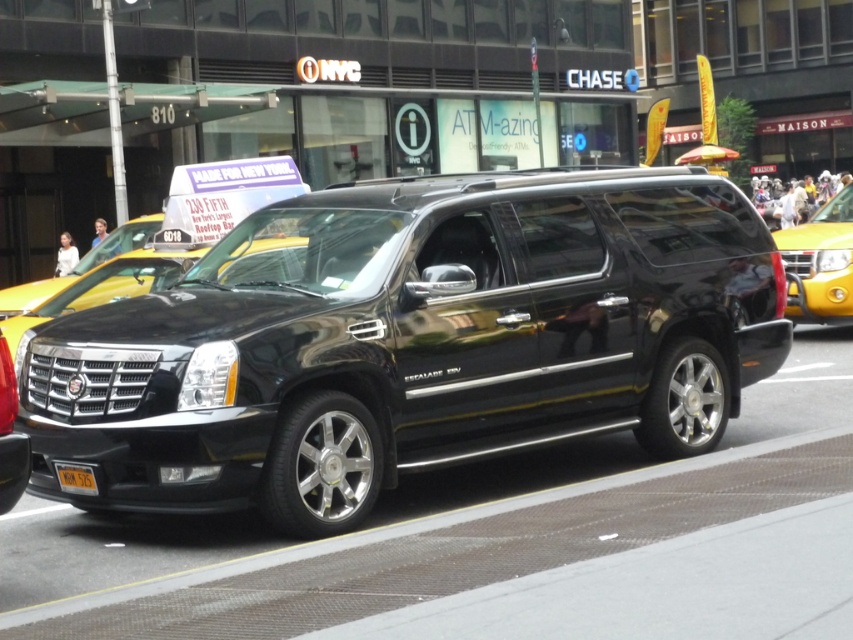
You are a delivery driver who needs to attach a magnetic sign to the roof of the shiny black minivan at center. However, there is a yellow matte license plate at center in the way. Can you place the sign on the roof without moving the license plate?

The shiny black minivan at center is located above the yellow matte license plate at center, so the license plate is not blocking the roof. You can safely attach the magnetic sign to the roof without moving the license plate.

Based on the photo, you are standing at the point marked by the coordinates point (85, 474) and want to walk towards the point marked by the coordinates point (500, 220). Given the urban street scene described, will you be moving towards the direction of the black Cadillac Escalade SUV parked along the curb?

Yes, since point (500, 220) is behind point (85, 474), moving towards it would mean walking in the direction of the black Cadillac Escalade SUV parked along the curb.

You are a delivery person who needs to park your 15 feet long truck between the shiny black minivan at center and the yellow matte taxi at right. Is there enough space between them to park your truck?

The distance between the shiny black minivan at center and the yellow matte taxi at right is 24.33 feet. Since your truck is 15 feet long, there is sufficient space to park between them as 24.33 feet is greater than 15 feet.